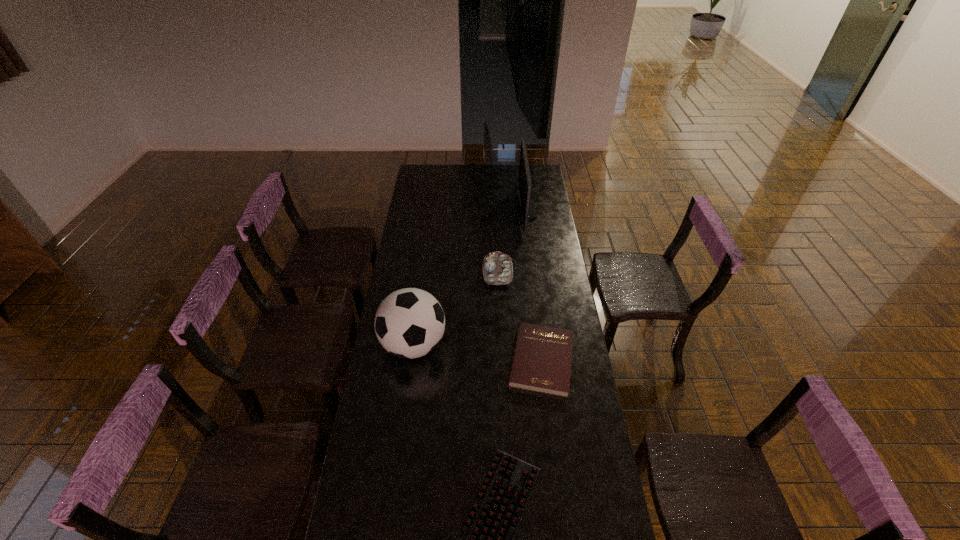
This screenshot has width=960, height=540. Find the location of `monitor`. monitor is located at coordinates (525, 206).

At what (x,y) coordinates should I click in order to perform the action: click on soccer ball. Please return your answer as a coordinate pair (x, y). This screenshot has width=960, height=540. Looking at the image, I should click on (409, 323).

This screenshot has height=540, width=960. I want to click on the second tallest object, so click(409, 323).

This screenshot has height=540, width=960. I want to click on the third shortest object, so click(x=497, y=267).

Locate an element on the screen. The image size is (960, 540). the fourth nearest object is located at coordinates (497, 267).

You are a GUI agent. You are given a task and a screenshot of the screen. Output one action in this format:
    pyautogui.click(x=<x>, y=<y>)
    Task: Click on the hardback book
    
    Given the screenshot: What is the action you would take?
    click(542, 358)

Where is `blank space located 0.210m on the screen side of the farthest object`? blank space located 0.210m on the screen side of the farthest object is located at coordinates (480, 211).

Identify the location of vacant space located 0.390m on the screen side of the farthest object. Image resolution: width=960 pixels, height=540 pixels. (448, 211).

This screenshot has height=540, width=960. Find the location of `vacant space located on the screen side of the farthest object`. vacant space located on the screen side of the farthest object is located at coordinates (501, 211).

Locate an element on the screen. vacant space located 0.050m on the back of the second tallest object is located at coordinates (419, 310).